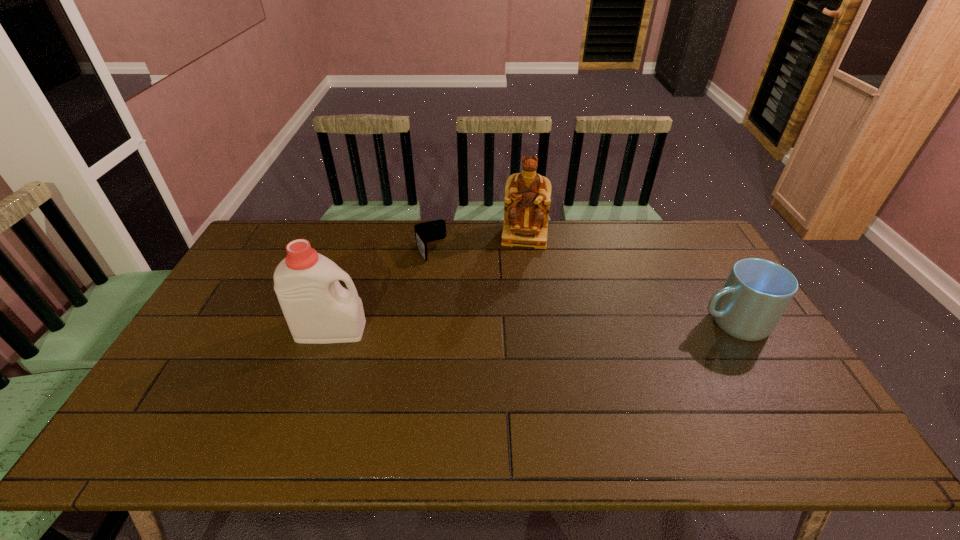
Locate an element on the screen. vacant space at the right edge of the desktop is located at coordinates (760, 380).

What are the coordinates of `vacant space at the far left corner` in the screenshot? It's located at (289, 220).

This screenshot has height=540, width=960. I want to click on free space between the second object from right to left and the rightmost object, so click(628, 279).

Locate an element on the screen. The image size is (960, 540). vacant point located between the mug and the wallet is located at coordinates (581, 286).

Find the location of a particular element. The height and width of the screenshot is (540, 960). vacant area that lies between the figurine and the detergent is located at coordinates (427, 284).

At what (x,y) coordinates should I click in order to perform the action: click on free space between the wallet and the figurine. Please return your answer as a coordinate pair (x, y). The height and width of the screenshot is (540, 960). Looking at the image, I should click on (477, 243).

Image resolution: width=960 pixels, height=540 pixels. What are the coordinates of `vacant space that is in between the wallet and the leftmost object` in the screenshot? It's located at (380, 291).

You are a GUI agent. You are given a task and a screenshot of the screen. Output one action in this format:
    pyautogui.click(x=<x>, y=<y>)
    Task: Click on the free space between the leftmost object and the mug
    Image resolution: width=960 pixels, height=540 pixels.
    Given the screenshot: What is the action you would take?
    pyautogui.click(x=531, y=327)

I want to click on free area in between the third object from right to left and the second object from right to left, so [x=477, y=243].

In order to click on free area in between the second object from right to left and the third tallest object in this screenshot , I will do `click(628, 279)`.